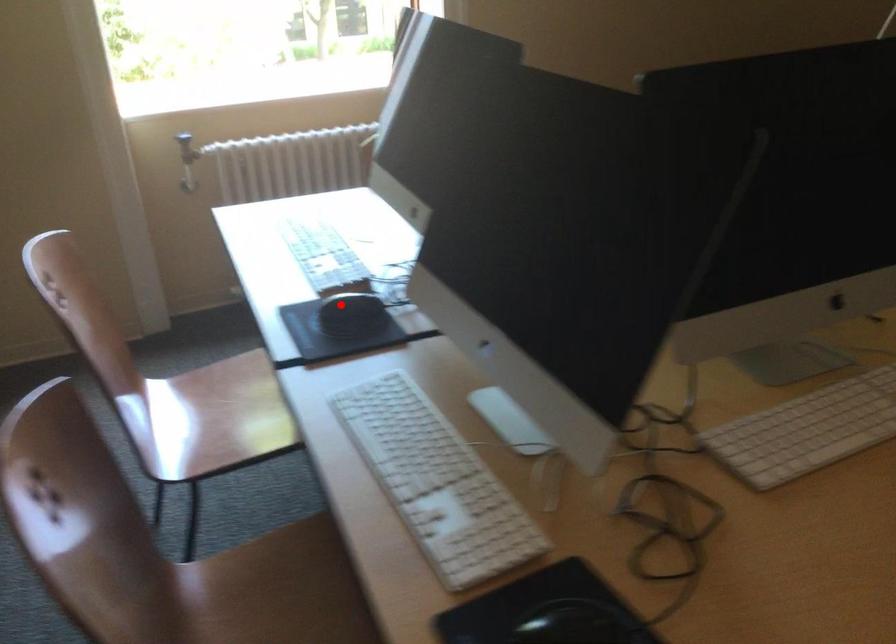
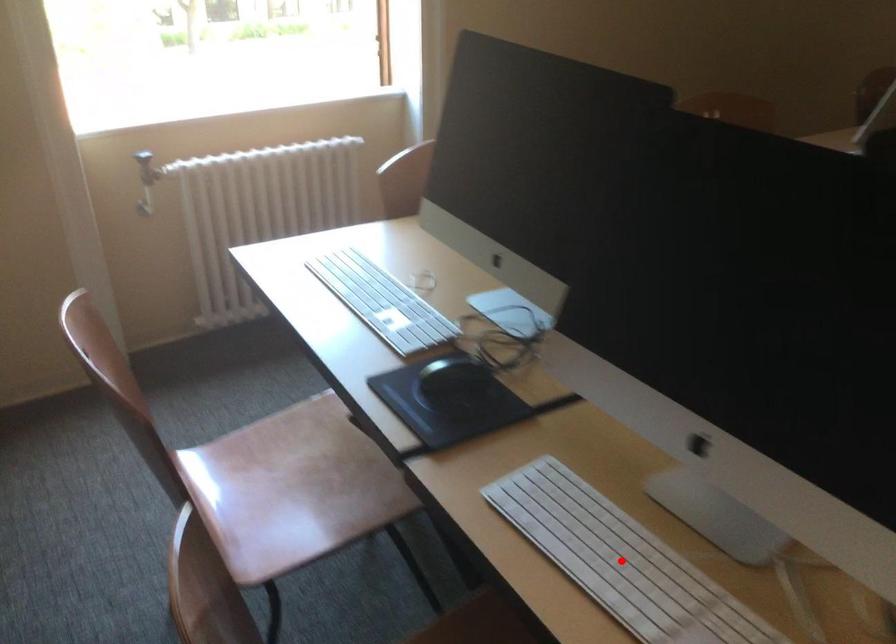
I am providing you with two images of the same scene from different viewpoints. A red point is marked on the first image and another point is marked on the second image. Is the marked point in image1 the same physical position as the marked point in image2?

No